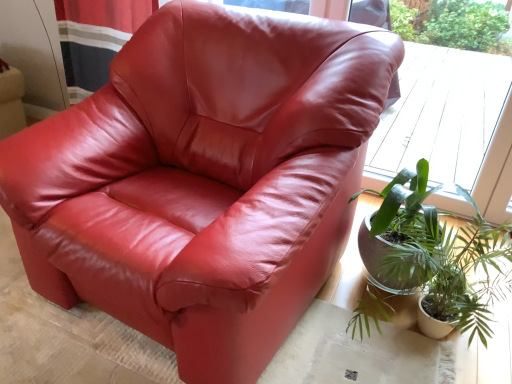
Question: From a real-world perspective, is transparent glass window at upper center physically located above or below green leafy plant at lower right?

Choices:
 (A) above
 (B) below

Answer: (A)

Question: Is transparent glass window at upper center inside or outside of green leafy plant at lower right?

Choices:
 (A) inside
 (B) outside

Answer: (B)

Question: Relative to green leafy plant at lower right, is transparent glass window at upper center in front or behind?

Choices:
 (A) front
 (B) behind

Answer: (B)

Question: From the image's perspective, is green leafy plant at lower right located above or below transparent glass window at upper center?

Choices:
 (A) above
 (B) below

Answer: (B)

Question: Looking at their shapes, would you say green leafy plant at lower right is wider or thinner than transparent glass window at upper center?

Choices:
 (A) thin
 (B) wide

Answer: (B)

Question: Relative to transparent glass window at upper center, is green leafy plant at lower right in front or behind?

Choices:
 (A) front
 (B) behind

Answer: (A)

Question: Considering the relative positions of green leafy plant at lower right and transparent glass window at upper center in the image provided, is green leafy plant at lower right to the left or to the right of transparent glass window at upper center?

Choices:
 (A) right
 (B) left

Answer: (B)